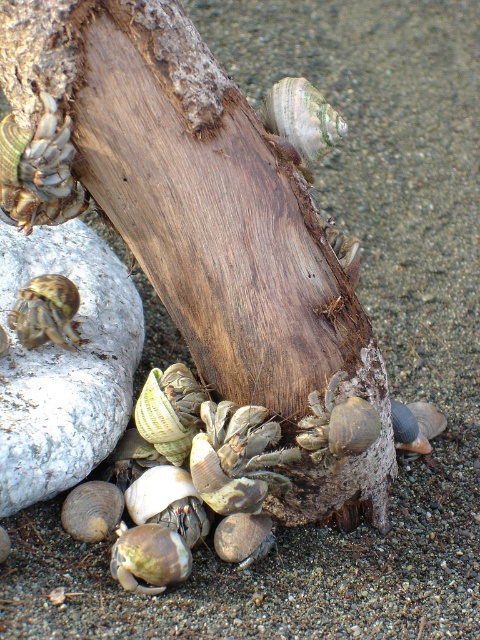
Question: Which object is the farthest from the matte brown shell at upper left?

Choices:
 (A) dark brown wood at center
 (B) brown textured hermit crab at lower left
 (C) smooth brown shell at center
 (D) shiny silver shell at center

Answer: (C)

Question: Considering the relative positions of shiny silver shell at center and brown textured hermit crab at lower left in the image provided, where is shiny silver shell at center located with respect to brown textured hermit crab at lower left?

Choices:
 (A) below
 (B) above

Answer: (B)

Question: Does shiny silver shell at center have a smaller size compared to smooth brown shell at center?

Choices:
 (A) yes
 (B) no

Answer: (B)

Question: Among these objects, which one is nearest to the camera?

Choices:
 (A) brown textured hermit crab at lower left
 (B) dark brown wood at center

Answer: (B)

Question: Does dark brown wood at center have a greater width compared to shiny silver shell at center?

Choices:
 (A) yes
 (B) no

Answer: (A)

Question: Which point is farther from the camera taking this photo?

Choices:
 (A) (136, 330)
 (B) (131, 72)

Answer: (A)